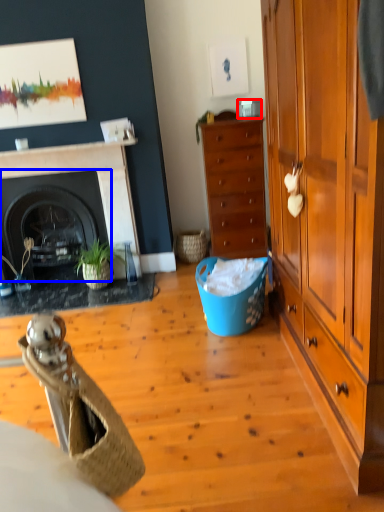
Question: Which point is further to the camera, corded phone (highlighted by a red box) or fireplace (highlighted by a blue box)?

Choices:
 (A) corded phone
 (B) fireplace

Answer: (B)